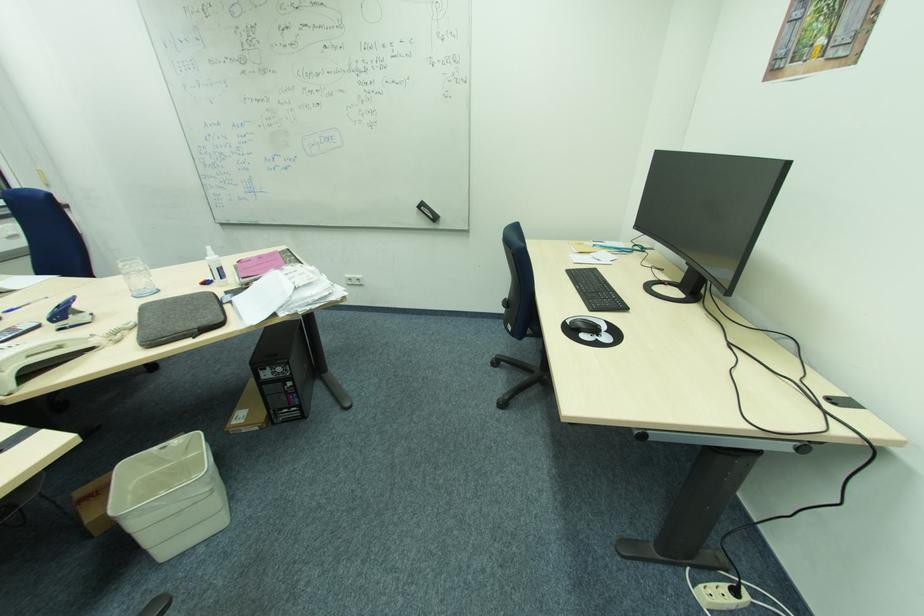
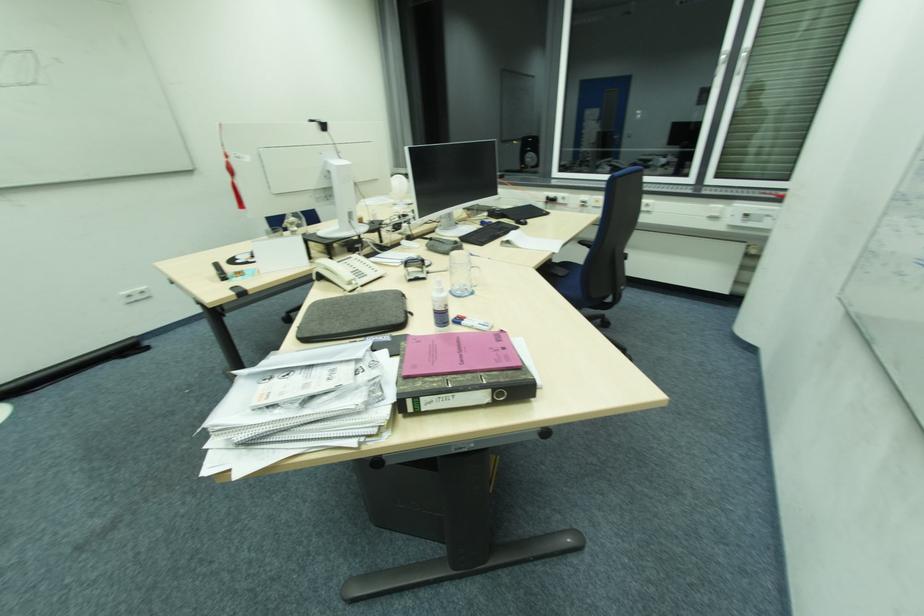
Question: I am providing you with two images of the same scene from different viewpoints. Which of the following objects are not visible in image2?

Choices:
 (A) grey laptop sleeve
 (B) phone handset
 (C) chair armrest
 (D) none of these

Answer: (D)